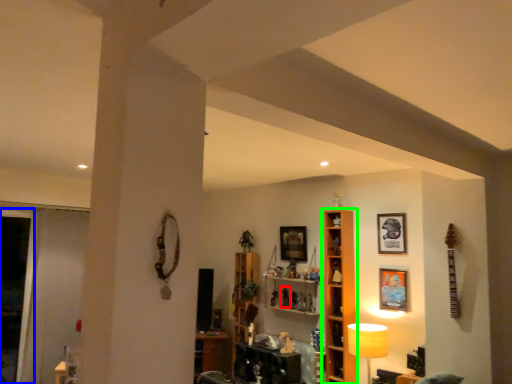
Question: Which object is positioned closest to toy (highlighted by a red box)? Select from glass door (highlighted by a blue box) and shelf (highlighted by a green box).

Choices:
 (A) glass door
 (B) shelf

Answer: (B)